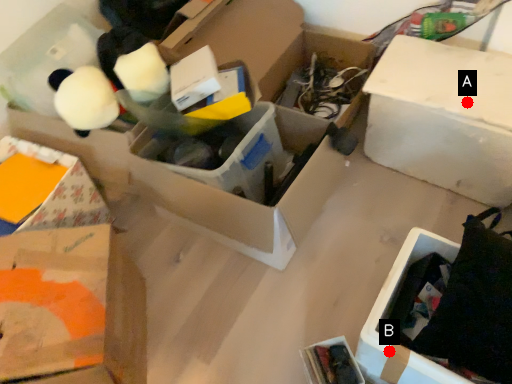
Question: Two points are circled on the image, labeled by A and B beside each circle. Which point appears closest to the camera in this image?

Choices:
 (A) A is closer
 (B) B is closer

Answer: (B)